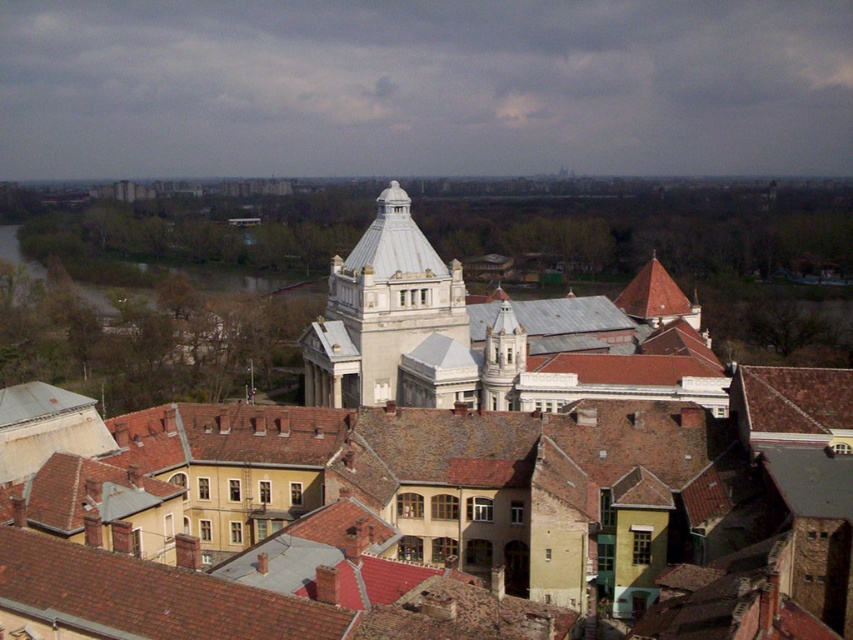
You are a tourist standing in the city and want to take a photo of the white marble tower at center. However, you notice the brown muddy water at left in the background. Can you determine if the tower will be visible in the photo if you aim your camera towards the tower?

The white marble tower at center is in front of the brown muddy water at left, so the tower will block the view of the brown muddy water at left and will be visible in the photo.

You are an urban planner reviewing this cityscape. You need to determine which area is larger in the image between the white marble tower at center and the brown muddy water at left. Which one is larger?

The brown muddy water at left occupies more space in the image than the white marble tower at center, so the brown muddy water at left is larger.

You are a city planner reviewing this cityscape. You need to place a new public bench in the park area. Considering the location of the white stone building at center, which is at coordinates approximately 0.7, 0.6 on the image grid, where should the bench be placed to ensure it is within the park area and not too close to the building?

The white stone building at center is located at point (509, 445). To place the bench within the park area and avoid being too close to the building, position it away from the building coordinates, ensuring it stays in the midground green space described as the park or garden.